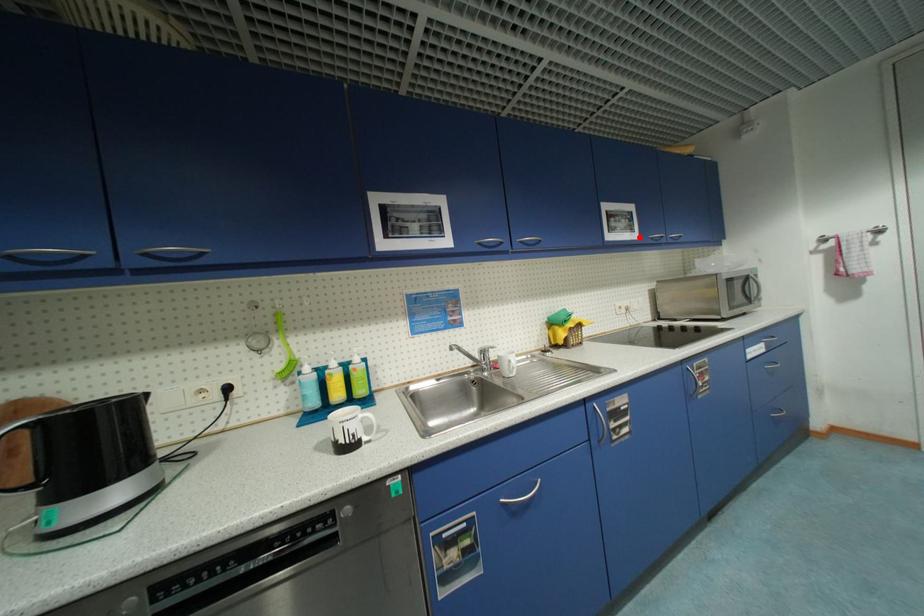
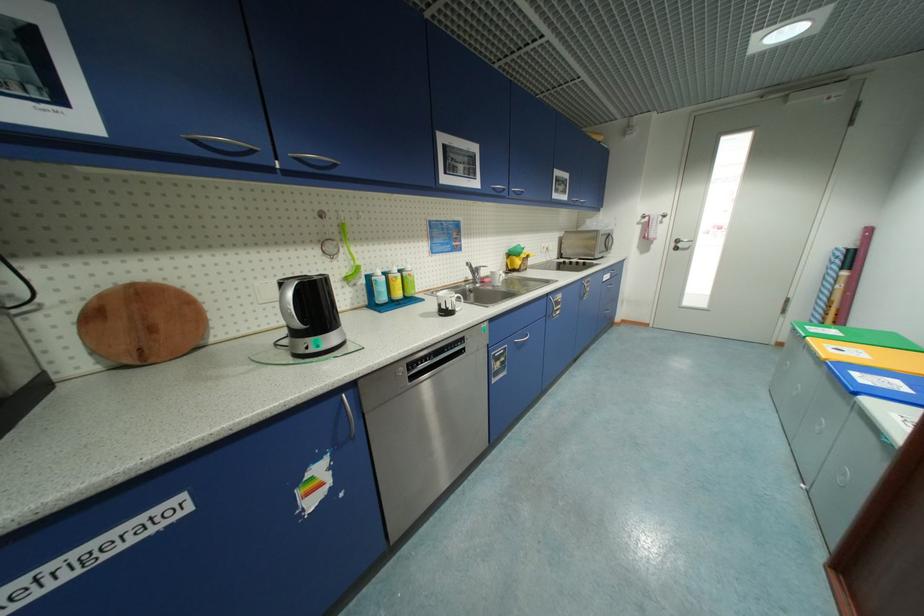
In the second image, find the point that corresponds to the highlighted location in the first image.

(570, 199)